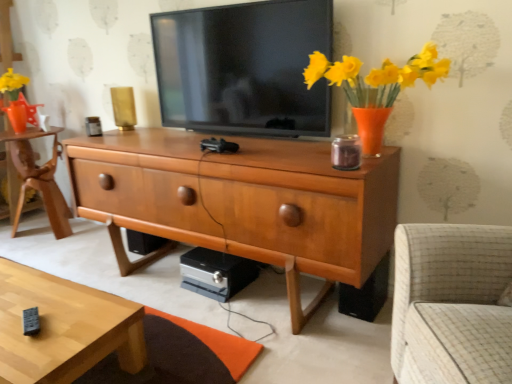
Question: Should I look upward or downward to see light wood/texture coffee table at lower left?

Choices:
 (A) down
 (B) up

Answer: (A)

Question: Is light brown wooden desk at left closer to camera compared to black plastic speaker at lower right?

Choices:
 (A) no
 (B) yes

Answer: (A)

Question: Considering the relative positions of light brown wooden desk at left and black plastic speaker at lower right in the image provided, is light brown wooden desk at left to the right of black plastic speaker at lower right from the viewer's perspective?

Choices:
 (A) no
 (B) yes

Answer: (A)

Question: Does light brown wooden desk at left appear on the left side of black plastic speaker at lower right?

Choices:
 (A) no
 (B) yes

Answer: (B)

Question: Can you confirm if light brown wooden desk at left is shorter than black plastic speaker at lower right?

Choices:
 (A) no
 (B) yes

Answer: (A)

Question: Is light brown wooden desk at left completely or partially outside of black plastic speaker at lower right?

Choices:
 (A) yes
 (B) no

Answer: (A)

Question: Is light brown wooden desk at left facing away from black plastic speaker at lower right?

Choices:
 (A) no
 (B) yes

Answer: (A)

Question: From a real-world perspective, is black plastic speaker at lower right under light brown wooden desk at left?

Choices:
 (A) no
 (B) yes

Answer: (B)

Question: Considering the relative positions of black plastic speaker at lower right and light brown wooden desk at left in the image provided, is black plastic speaker at lower right in front of light brown wooden desk at left?

Choices:
 (A) no
 (B) yes

Answer: (B)

Question: Is the depth of black plastic speaker at lower right greater than that of light brown wooden desk at left?

Choices:
 (A) no
 (B) yes

Answer: (A)

Question: Can you confirm if black plastic speaker at lower right is shorter than light brown wooden desk at left?

Choices:
 (A) yes
 (B) no

Answer: (A)

Question: Does black plastic speaker at lower right appear on the right side of light brown wooden desk at left?

Choices:
 (A) yes
 (B) no

Answer: (A)

Question: Is black plastic speaker at lower right not close to light brown wooden desk at left?

Choices:
 (A) yes
 (B) no

Answer: (A)

Question: Is wooden chest of drawers at center looking in the opposite direction of black plastic speaker at lower right?

Choices:
 (A) no
 (B) yes

Answer: (B)